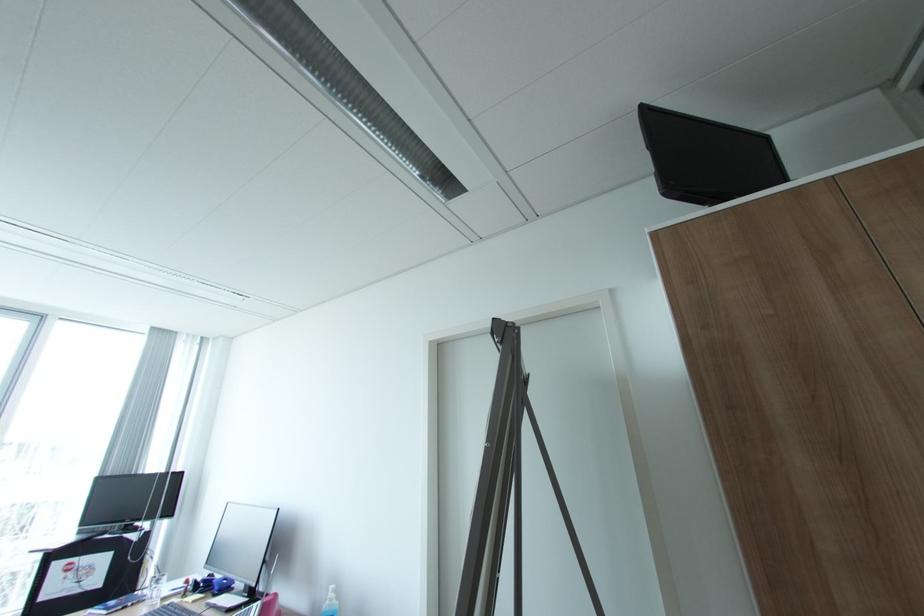
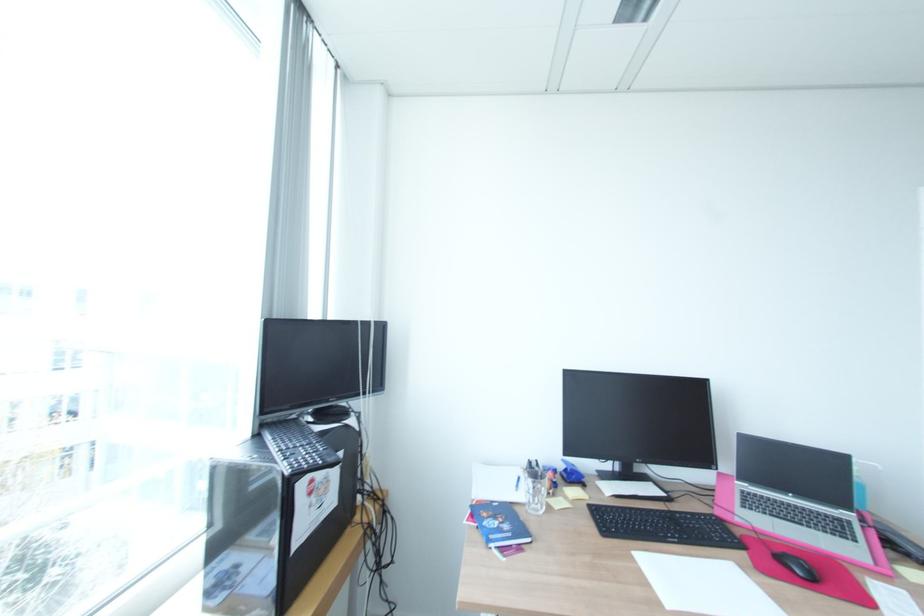
Where in the second image is the point corresponding to pixel 178 472 from the first image?

(381, 321)